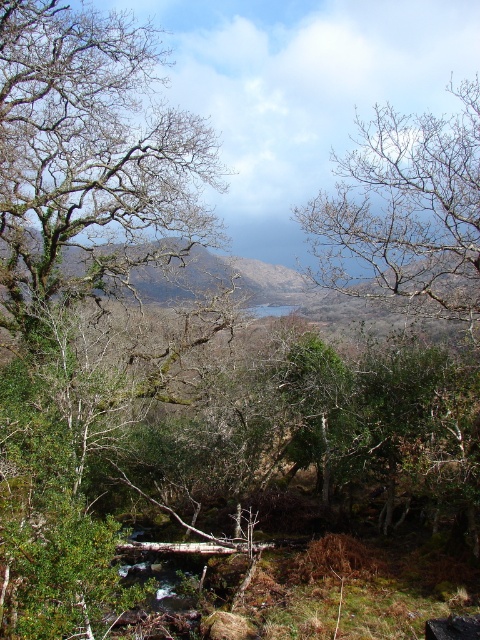
You are a hiker trying to determine the safest path to cross the stream. You notice the bare branches at upper center and the green mossy hillside at center. Which of these two features would provide a more stable footing for crossing?

The green mossy hillside at center provides more stable footing because it is thicker than the bare branches at upper center, which are thinner and less sturdy.

You are standing at the center of the image and want to locate the green mossy tree at left. Based on the coordinates provided, in which direction should you look to find it?

The green mossy tree at left is located at coordinates point (90, 154), which means it is positioned to the left and slightly downward from the center of the image. Therefore, you should look to the left and slightly downward to find it.